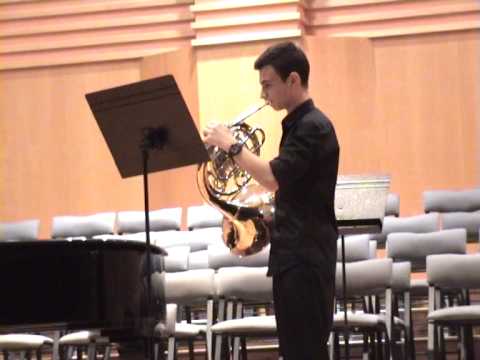
Where is `wooden wall`? Image resolution: width=480 pixels, height=360 pixels. wooden wall is located at coordinates (397, 111).